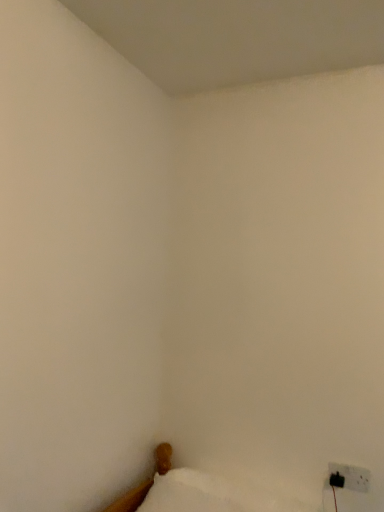
Question: Can you confirm if white fabric bed at lower right is positioned to the right of black plastic electric outlet at lower right?

Choices:
 (A) yes
 (B) no

Answer: (B)

Question: Is black plastic electric outlet at lower right at the back of white fabric bed at lower right?

Choices:
 (A) yes
 (B) no

Answer: (B)

Question: Is white fabric bed at lower right shorter than black plastic electric outlet at lower right?

Choices:
 (A) no
 (B) yes

Answer: (A)

Question: Does white fabric bed at lower right come behind black plastic electric outlet at lower right?

Choices:
 (A) no
 (B) yes

Answer: (A)

Question: Would you consider white fabric bed at lower right to be distant from black plastic electric outlet at lower right?

Choices:
 (A) yes
 (B) no

Answer: (B)

Question: Considering the relative positions of white fabric bed at lower right and black plastic electric outlet at lower right in the image provided, is white fabric bed at lower right to the left of black plastic electric outlet at lower right from the viewer's perspective?

Choices:
 (A) no
 (B) yes

Answer: (B)

Question: Is black plastic electric outlet at lower right wider than white fabric bed at lower right?

Choices:
 (A) yes
 (B) no

Answer: (B)

Question: Considering the relative sizes of black plastic electric outlet at lower right and white fabric bed at lower right in the image provided, is black plastic electric outlet at lower right smaller than white fabric bed at lower right?

Choices:
 (A) no
 (B) yes

Answer: (B)

Question: Is black plastic electric outlet at lower right facing away from white fabric bed at lower right?

Choices:
 (A) yes
 (B) no

Answer: (B)

Question: Is black plastic electric outlet at lower right positioned before white fabric bed at lower right?

Choices:
 (A) no
 (B) yes

Answer: (A)

Question: Would you say black plastic electric outlet at lower right contains white fabric bed at lower right?

Choices:
 (A) yes
 (B) no

Answer: (B)

Question: Does black plastic electric outlet at lower right have a larger size compared to white fabric bed at lower right?

Choices:
 (A) yes
 (B) no

Answer: (B)

Question: Is there a large distance between white soft pillow at lower left and black plastic electric outlet at lower right?

Choices:
 (A) no
 (B) yes

Answer: (A)